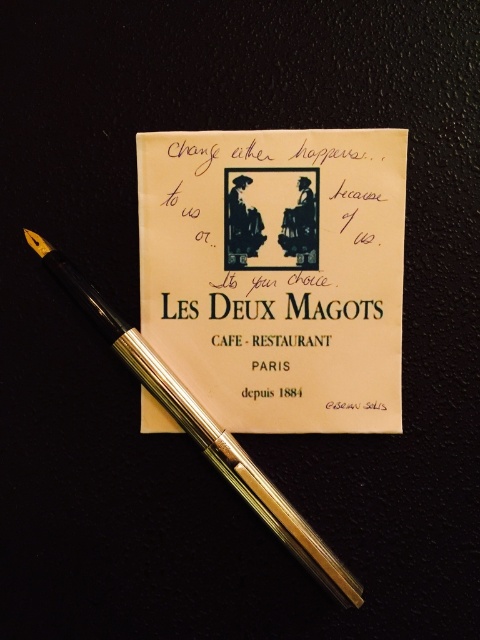
What are the coordinates of the white paper sign at center?

The white paper sign at center is located at point [276,273].

You are designing a layout for a promotional poster and need to place both the white paper sign at center and the gold polished fountain pen at center. If the poster has a maximum width of 20 cm, which object should you scale down to ensure both fit without overlapping?

The white paper sign at center has a smaller width than the gold polished fountain pen at center, so you should scale down the gold polished fountain pen at center to make both fit within the 20 cm width constraint.

You are a graphic designer working on a layout for a vintage postcard. You have two points marked on the card at coordinates point (319, 298) and point (359, 596). According to the image, which point is closer to the viewer?

Point (359, 596) is closer to the viewer because point (319, 298) is behind it.